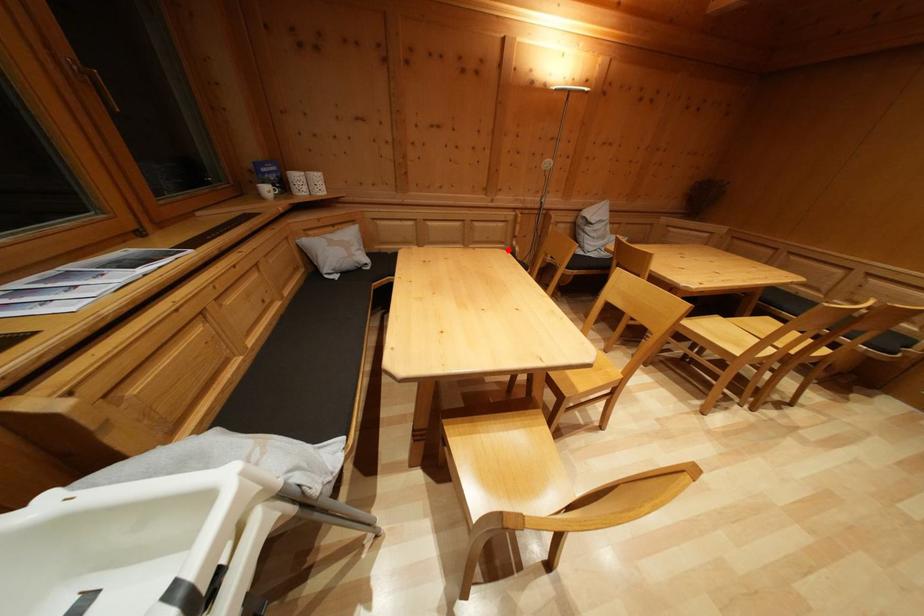
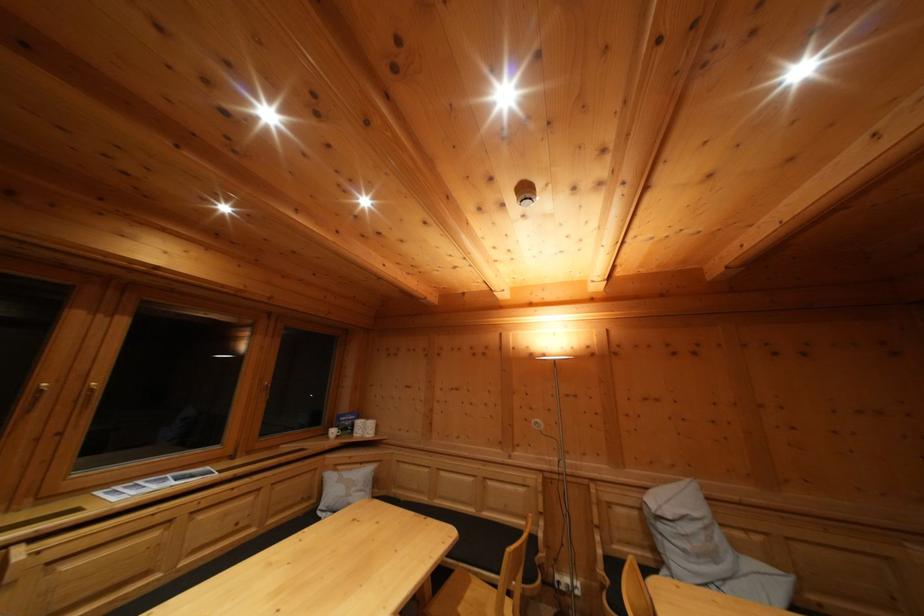
In the second image, find the point that corresponds to the highlighted location in the first image.

(532, 525)